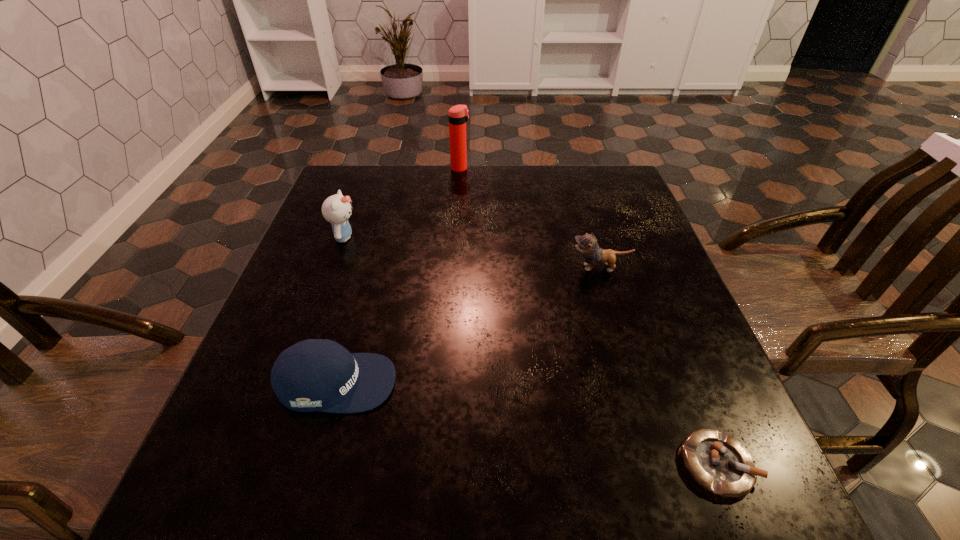
The height and width of the screenshot is (540, 960). What are the coordinates of `free point between the nearer kitten and the third object from left to right` in the screenshot? It's located at (530, 218).

Locate an element on the screen. The image size is (960, 540). vacant area that lies between the right kitten and the tallest object is located at coordinates (530, 218).

What are the coordinates of `unoccupied position between the nearest object and the third object from right to left` in the screenshot? It's located at (589, 316).

The height and width of the screenshot is (540, 960). I want to click on empty location between the third farthest object and the fourth shortest object, so (472, 253).

This screenshot has width=960, height=540. In order to click on free space between the right kitten and the second shortest object in this screenshot , I will do `click(468, 325)`.

I want to click on vacant space that is in between the farthest object and the baseball cap, so click(x=398, y=275).

You are a GUI agent. You are given a task and a screenshot of the screen. Output one action in this format:
    pyautogui.click(x=<x>, y=<y>)
    Task: Click on the free area in between the baseball cap and the tallest object
    
    Given the screenshot: What is the action you would take?
    pyautogui.click(x=398, y=275)

Find the location of `free space that is in between the third farthest object and the fourth nearest object`. free space that is in between the third farthest object and the fourth nearest object is located at coordinates (472, 253).

What are the coordinates of `free space between the farthest object and the left kitten` in the screenshot? It's located at (402, 203).

I want to click on the second closest object relative to the second tallest object, so click(458, 115).